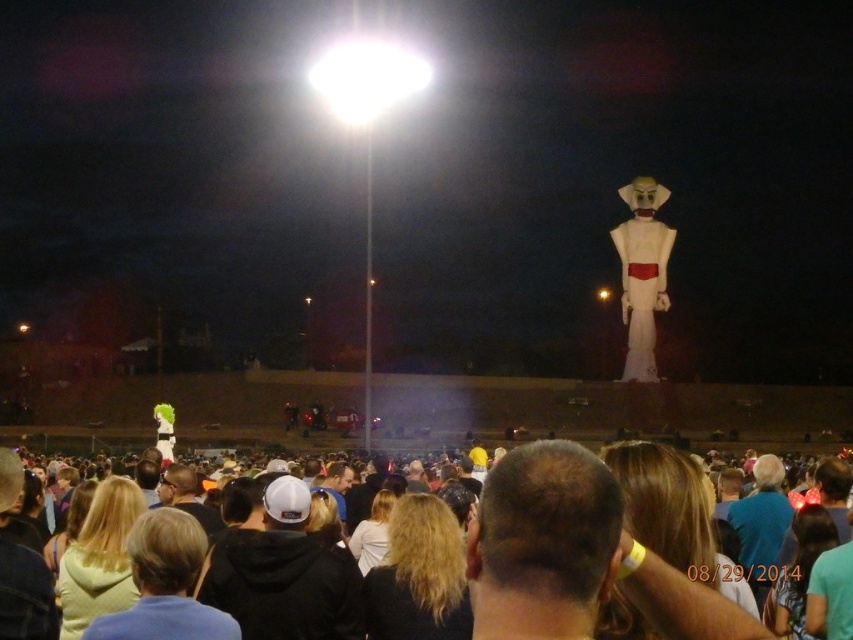
You are an observer looking at the nighttime scene. There is a point at coordinates point (607, 541). What object is located at that point?

The dark brown hair at center is located at point (607, 541).

You are an observer looking at the nighttime scene. You notice the dark brown hair at center and the white matte figure at upper right. Which object is positioned to the left of the other?

The dark brown hair at center is positioned to the left of the white matte figure at upper right.

You are an observer looking at the nighttime scene. You notice the dark brown hair at center and the white matte figure at upper right. Which object is positioned closer to you?

The dark brown hair at center is closer to the viewer than the white matte figure at upper right.